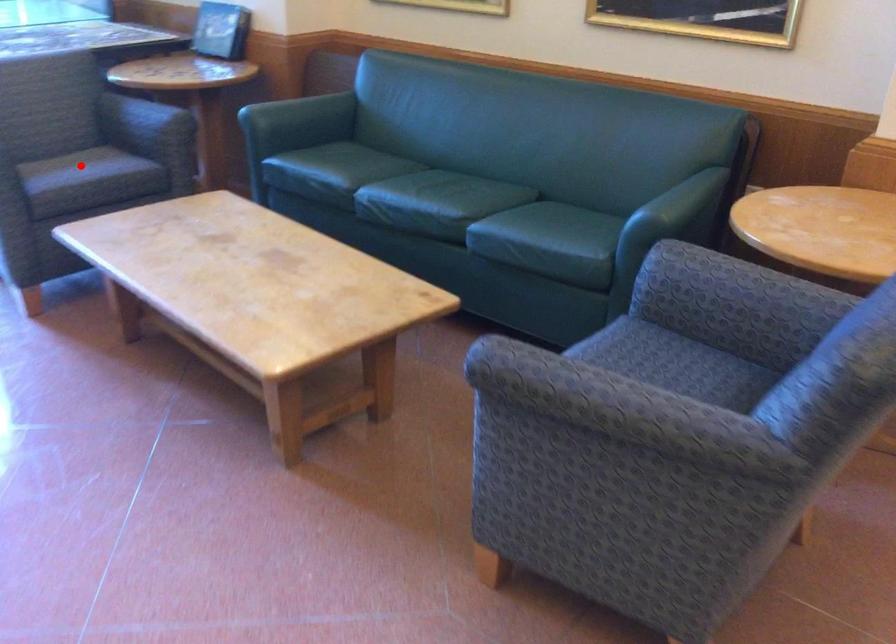
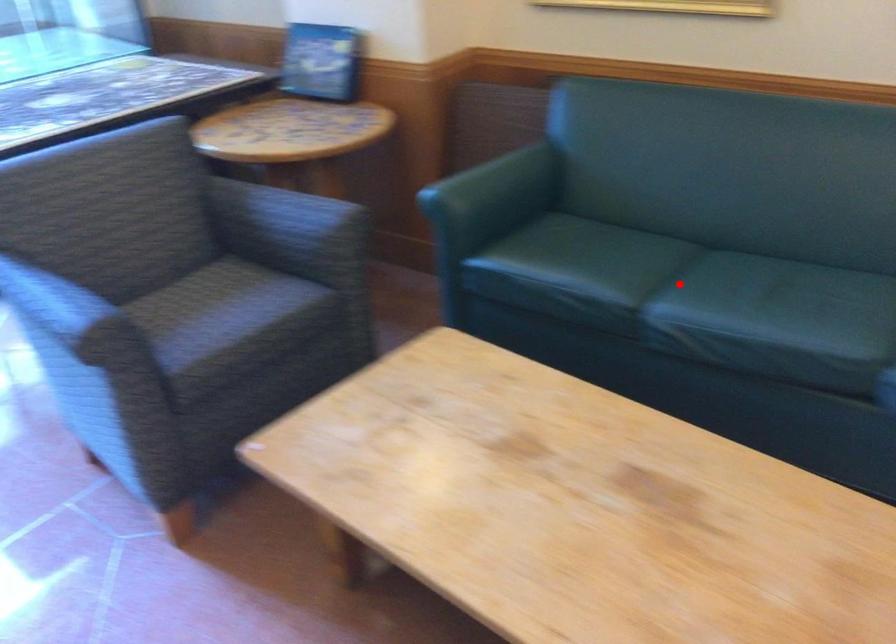
I am providing you with two images of the same scene from different viewpoints. A red point is marked on the first image and another point is marked on the second image. Is the marked point in image1 the same physical position as the marked point in image2?

No